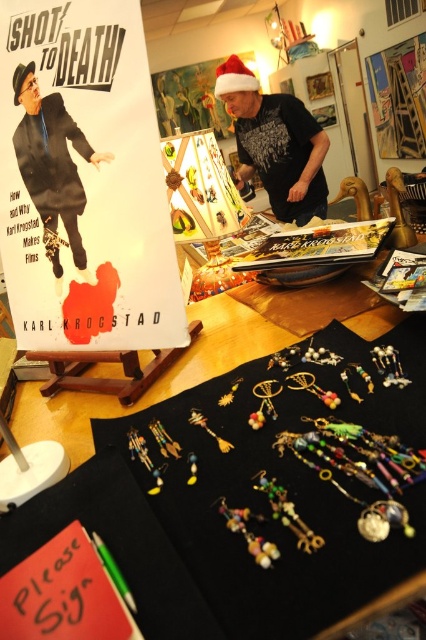
Question: Which point is farther from the camera taking this photo?

Choices:
 (A) (414, 129)
 (B) (213, 392)
 (C) (322, 205)
 (D) (31, 154)

Answer: (A)

Question: From the image, what is the correct spatial relationship of matte black shirt at upper center in relation to matte paper poster at upper center?

Choices:
 (A) left
 (B) right

Answer: (A)

Question: Is black fabric at center wider than matte black shirt at upper center?

Choices:
 (A) yes
 (B) no

Answer: (B)

Question: Which of the following is the farthest from the observer?

Choices:
 (A) matte black poster at upper left
 (B) multicolored beaded earrings at center

Answer: (A)

Question: Can you confirm if matte black poster at upper left is positioned below matte black shirt at upper center?

Choices:
 (A) yes
 (B) no

Answer: (A)

Question: Which object is farther from the camera taking this photo?

Choices:
 (A) black fabric at center
 (B) multicolored beaded earrings at center

Answer: (B)